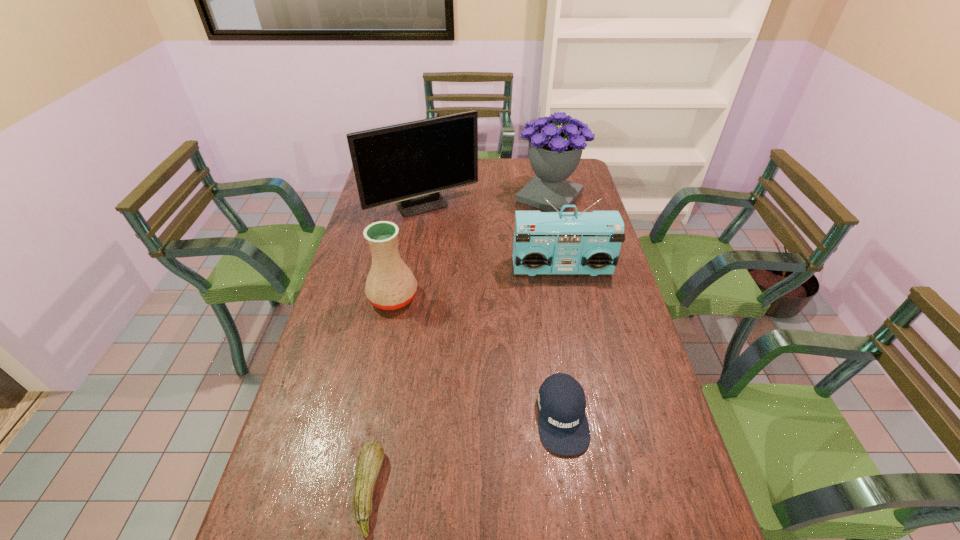
Where is `vacant space located 0.150m on the front-facing side of the baseball cap`? vacant space located 0.150m on the front-facing side of the baseball cap is located at coordinates (579, 528).

Locate an element on the screen. Image resolution: width=960 pixels, height=540 pixels. vacant position located 0.190m at the stem end of the shortest object is located at coordinates (468, 490).

In order to click on object present at the far edge in this screenshot , I will do `click(554, 152)`.

Locate an element on the screen. The image size is (960, 540). computer monitor positioned at the left edge is located at coordinates pos(408,164).

Find the location of a particular element. The height and width of the screenshot is (540, 960). pottery that is positioned at the left edge is located at coordinates (390, 285).

What are the coordinates of `bouquet located at the right edge` in the screenshot? It's located at (554, 152).

Identify the location of radio receiver located at the right edge. The image size is (960, 540). (544, 242).

I want to click on object located at the far right corner, so click(x=554, y=152).

You are a GUI agent. You are given a task and a screenshot of the screen. Output one action in this format:
    pyautogui.click(x=<x>, y=<y>)
    Task: Click on the free space at the far edge of the desktop
    Image resolution: width=960 pixels, height=540 pixels.
    Given the screenshot: What is the action you would take?
    pyautogui.click(x=529, y=161)

The height and width of the screenshot is (540, 960). I want to click on free region at the left edge of the desktop, so click(x=355, y=292).